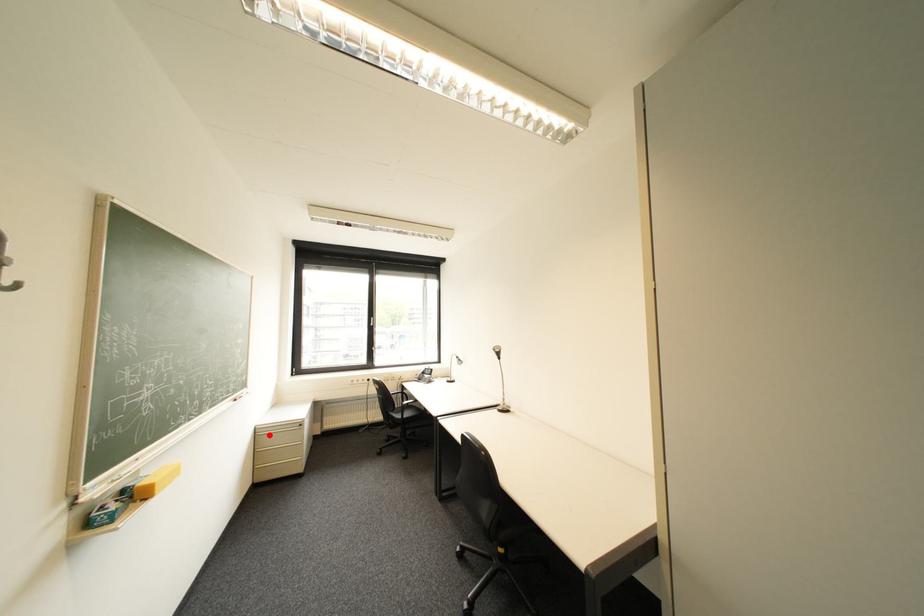
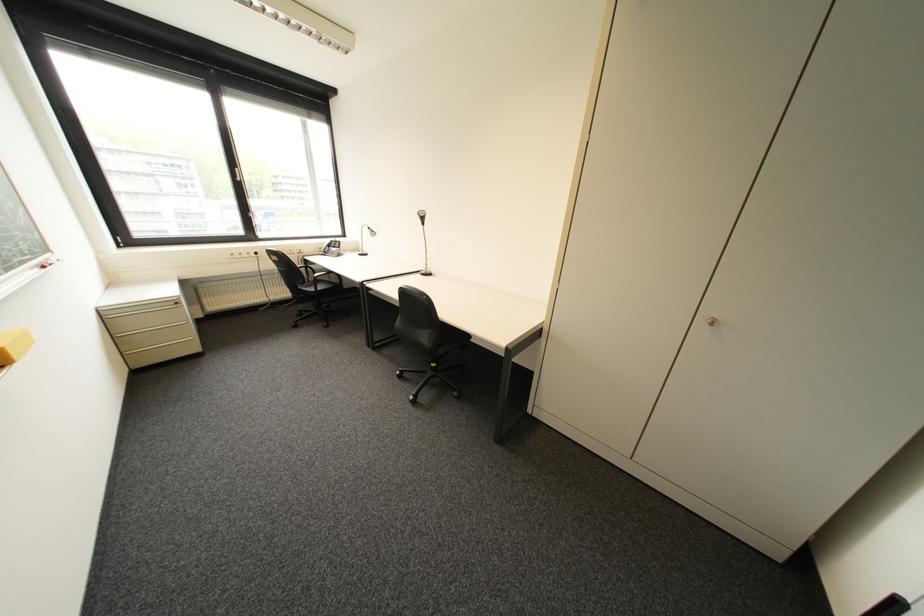
Find the pixel in the second image that matches the highlighted location in the first image.

(119, 318)